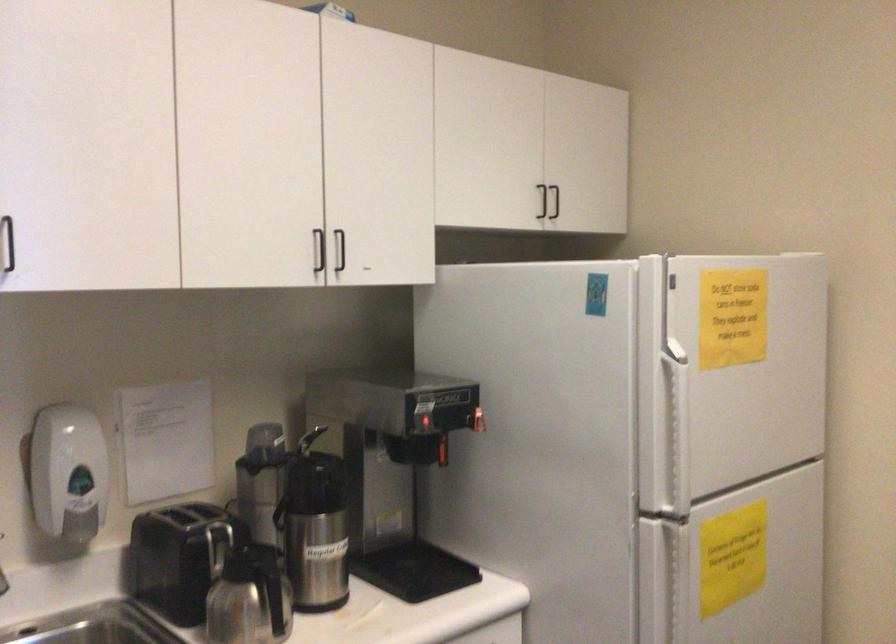
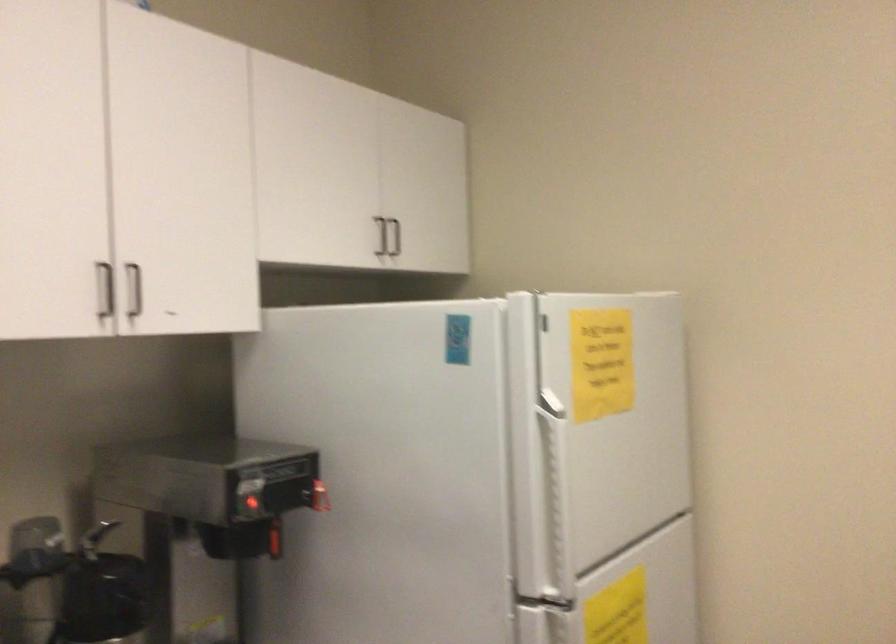
Locate, in the second image, the point that corresponds to the point at 334,252 in the first image.

(133, 290)